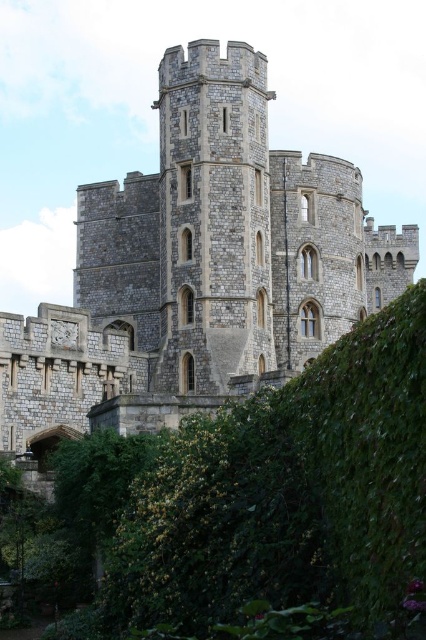
Question: Which point is farther to the camera?

Choices:
 (A) stone medieval tower at center
 (B) stone tower at center
 (C) green leafy hedge at lower left

Answer: (A)

Question: Which of the following is the farthest from the observer?

Choices:
 (A) stone tower at center
 (B) green leafy hedge at lower left
 (C) stone medieval tower at center

Answer: (C)

Question: Among these points, which one is farthest from the camera?

Choices:
 (A) (256, 358)
 (B) (91, 561)
 (C) (207, 272)

Answer: (C)

Question: Is stone tower at center smaller than stone medieval tower at center?

Choices:
 (A) no
 (B) yes

Answer: (A)

Question: Does green leafy hedge at lower left have a greater width compared to stone medieval tower at center?

Choices:
 (A) no
 (B) yes

Answer: (B)

Question: Does stone tower at center come behind green leafy hedge at lower left?

Choices:
 (A) no
 (B) yes

Answer: (B)